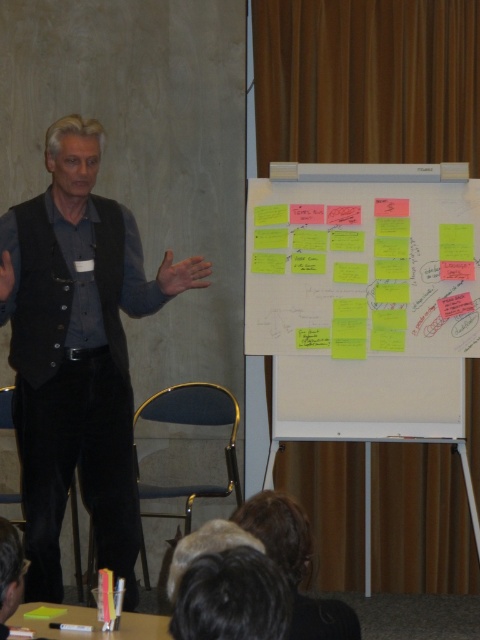
Question: Can you confirm if yellow sticky notes at center is thinner than black matte vest at left?

Choices:
 (A) no
 (B) yes

Answer: (A)

Question: Which point is farther to the camera?

Choices:
 (A) (360, 344)
 (B) (61, 422)

Answer: (A)

Question: Does yellow sticky notes at center lie in front of black matte vest at left?

Choices:
 (A) no
 (B) yes

Answer: (A)

Question: Which of the following is the closest to the observer?

Choices:
 (A) black matte vest at left
 (B) yellow sticky notes at center

Answer: (A)

Question: Is yellow sticky notes at center to the left of black matte vest at left from the viewer's perspective?

Choices:
 (A) no
 (B) yes

Answer: (A)